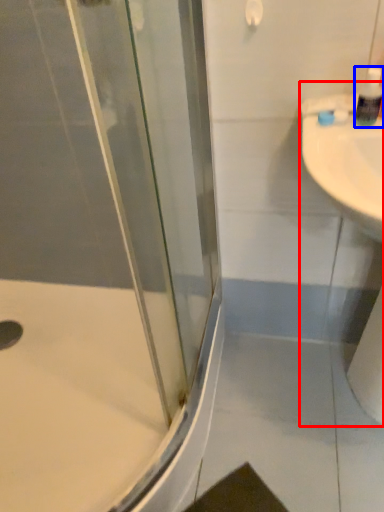
Question: Which of the following is the closest to the observer, sink (highlighted by a red box) or soap dispenser (highlighted by a blue box)?

Choices:
 (A) sink
 (B) soap dispenser

Answer: (A)